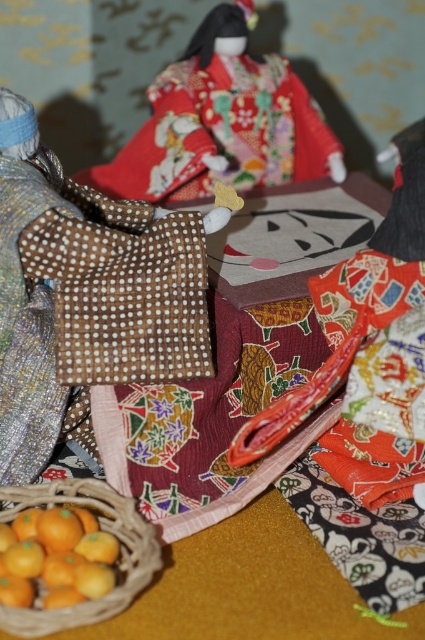
Does point (45, 576) come in front of point (20, 502)?

Yes, point (45, 576) is in front of point (20, 502).

Image resolution: width=425 pixels, height=640 pixels. Describe the element at coordinates (56, 557) in the screenshot. I see `yellow matte oranges at lower left` at that location.

Where is `yellow matte oranges at lower left`? yellow matte oranges at lower left is located at coordinates (56, 557).

In the scene shown: Can you confirm if brown dotted fabric bag at center is taller than silky red kimono at upper center?

Yes, brown dotted fabric bag at center is taller than silky red kimono at upper center.

Is brown dotted fabric bag at center thinner than silky red kimono at upper center?

Yes.

In order to click on brown dotted fabric bag at center in this screenshot , I will do `click(87, 296)`.

Which is below, silky red kimono at upper center or yellow matte oranges at lower left?

yellow matte oranges at lower left is lower down.

Who is shorter, silky red kimono at upper center or yellow matte oranges at lower left?

With less height is yellow matte oranges at lower left.

Is point (198, 152) positioned before point (17, 540)?

No.

The height and width of the screenshot is (640, 425). In order to click on silky red kimono at upper center in this screenshot , I will do `click(221, 122)`.